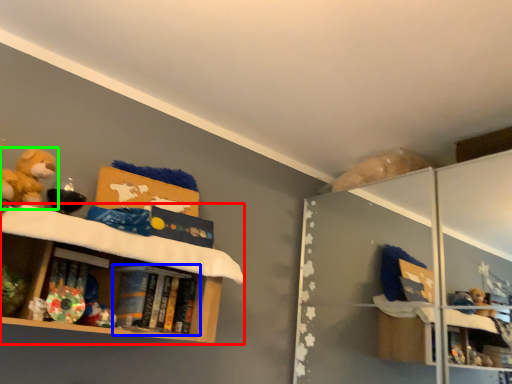
Question: Based on their relative distances, which object is farther from shelf (highlighted by a red box)? Choose from book (highlighted by a blue box) and toy (highlighted by a green box).

Choices:
 (A) book
 (B) toy

Answer: (B)